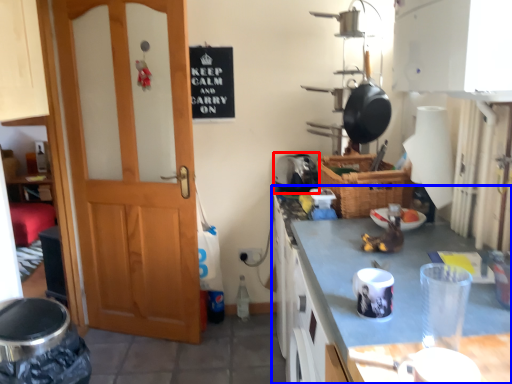
Question: Which object appears closest to the camera in this image, appliance (highlighted by a red box) or cabinetry (highlighted by a blue box)?

Choices:
 (A) appliance
 (B) cabinetry

Answer: (B)